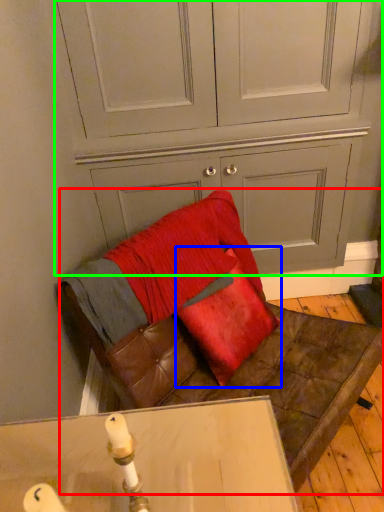
Question: Which is nearer to the furniture (highlighted by a red box)? throw pillow (highlighted by a blue box) or dresser (highlighted by a green box).

Choices:
 (A) throw pillow
 (B) dresser

Answer: (A)